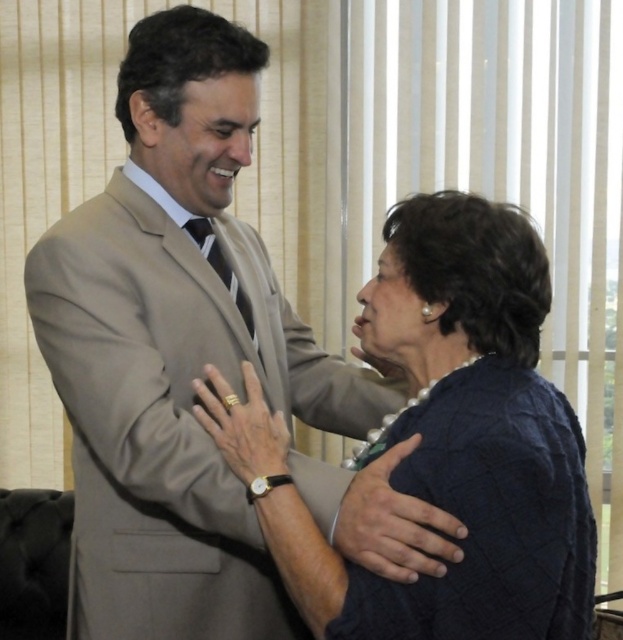
Is point (155, 13) farther from camera compared to point (300, 563)?

Yes, point (155, 13) is behind point (300, 563).

Is light brown suit at center thinner than dark blue textured sweater at center?

No, light brown suit at center is not thinner than dark blue textured sweater at center.

Find the location of a particular element. The width and height of the screenshot is (623, 640). light brown suit at center is located at coordinates (176, 349).